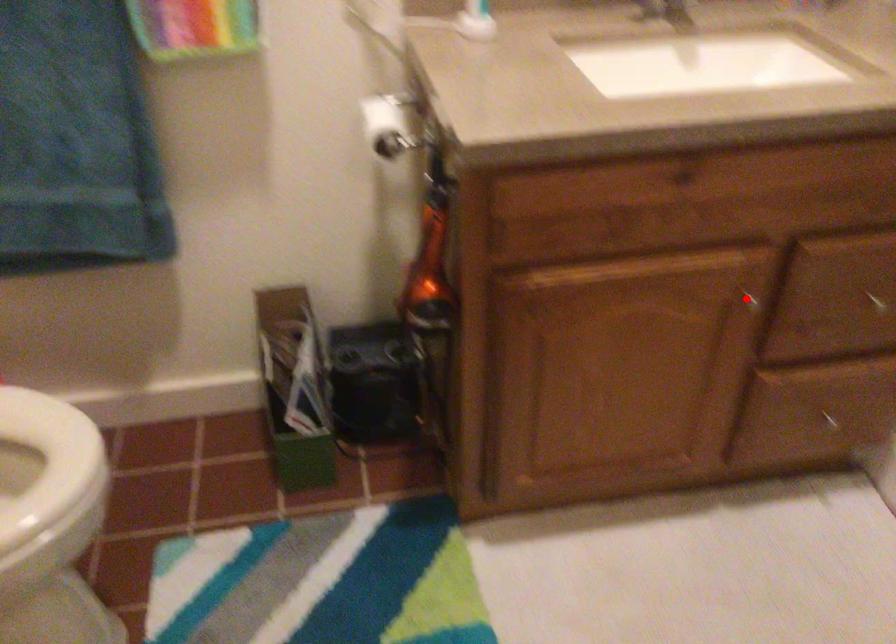
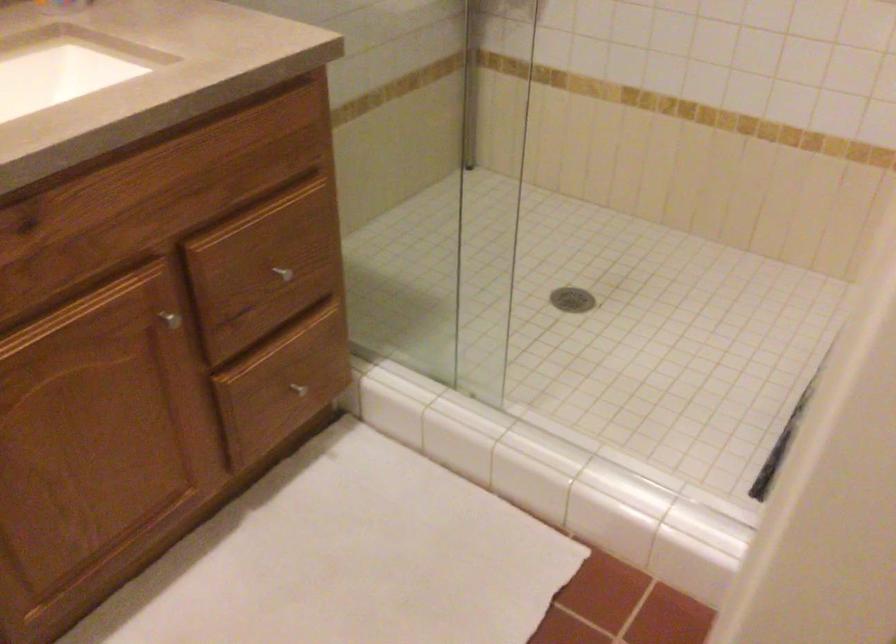
Locate, in the second image, the point that corresponds to the highlighted location in the first image.

(169, 319)